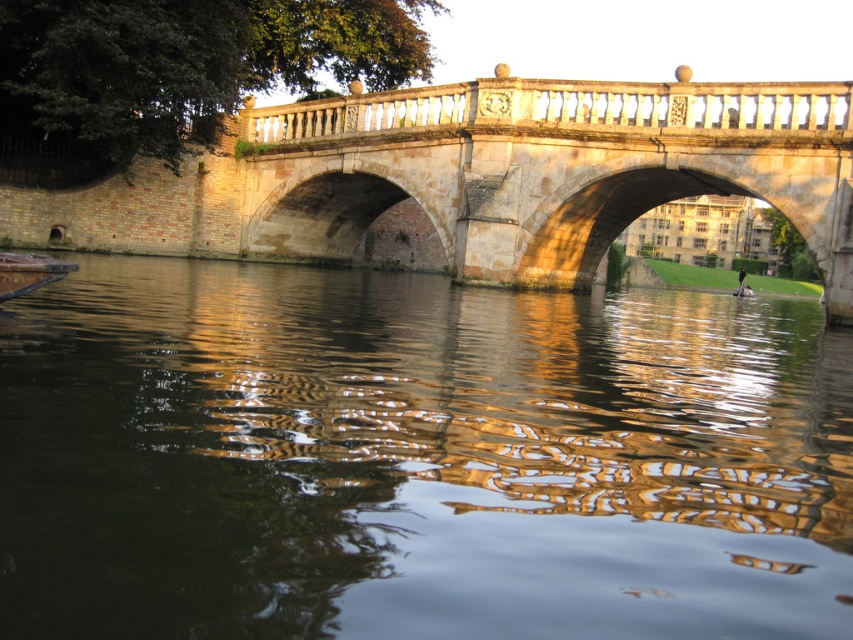
Between dark brown water at center and stone bridge at center, which one is positioned higher?

stone bridge at center

Based on the photo, between dark brown water at center and stone bridge at center, which one has less height?

Standing shorter between the two is dark brown water at center.

Find the location of a particular element. dark brown water at center is located at coordinates (416, 460).

This screenshot has width=853, height=640. What are the coordinates of `dark brown water at center` in the screenshot? It's located at (416, 460).